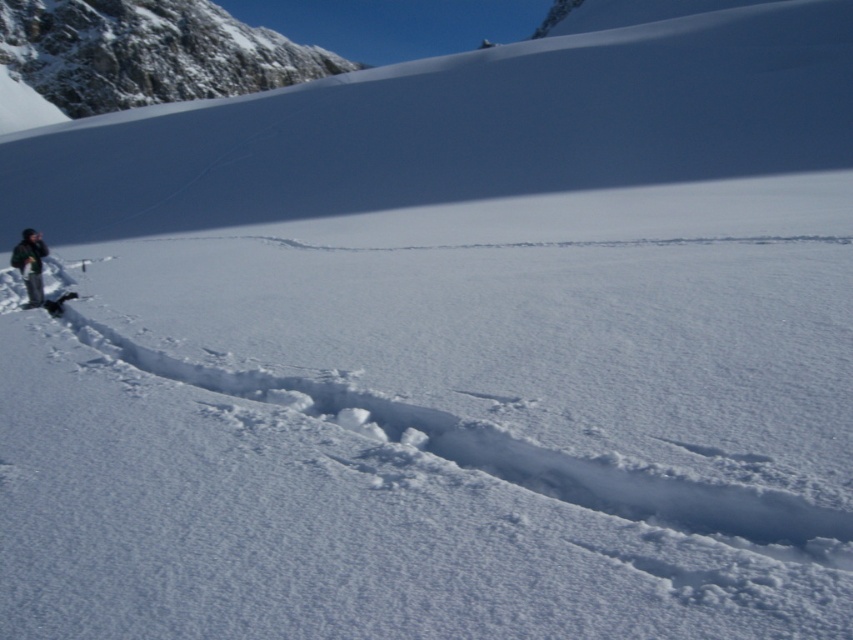
Question: Is black fabric jacket at left wider than black matte ski at left?

Choices:
 (A) no
 (B) yes

Answer: (B)

Question: Which object is farther from the camera taking this photo?

Choices:
 (A) black matte ski at left
 (B) black fabric jacket at left

Answer: (B)

Question: Observing the image, what is the correct spatial positioning of black fabric jacket at left in reference to black matte ski at left?

Choices:
 (A) below
 (B) above

Answer: (B)

Question: Does black fabric jacket at left have a lesser width compared to black matte ski at left?

Choices:
 (A) no
 (B) yes

Answer: (A)